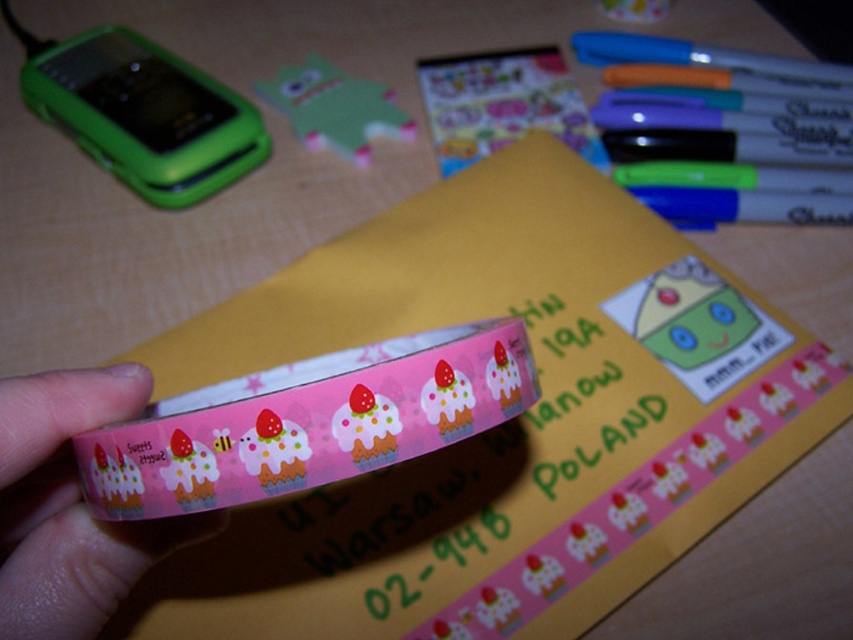
Who is positioned more to the left, metallic silver markers at upper right or pink glossy tape at center?

From the viewer's perspective, pink glossy tape at center appears more on the left side.

Does point (811, 109) come behind point (102, 584)?

That is True.

In order to click on metallic silver markers at upper right in this screenshot , I will do `click(730, 145)`.

Is point (456, 417) closer to camera compared to point (90, 554)?

Yes, it is in front of point (90, 554).

Does pink matte tape at center appear on the left side of pink glossy tape at center?

In fact, pink matte tape at center is to the right of pink glossy tape at center.

Which is behind, point (96, 445) or point (45, 417)?

The point (45, 417) is behind.

At what (x,y) coordinates should I click in order to perform the action: click on pink matte tape at center. Please return your answer as a coordinate pair (x, y). The image size is (853, 640). Looking at the image, I should click on (309, 420).

Which is below, metallic silver markers at upper right or pink glossy sticker at center?

metallic silver markers at upper right

Between point (762, 80) and point (439, 96), which one is positioned in front?

Point (762, 80) is in front.

Between point (619, 118) and point (531, 124), which one is positioned in front?

Positioned in front is point (619, 118).

I want to click on metallic silver markers at upper right, so coord(730,145).